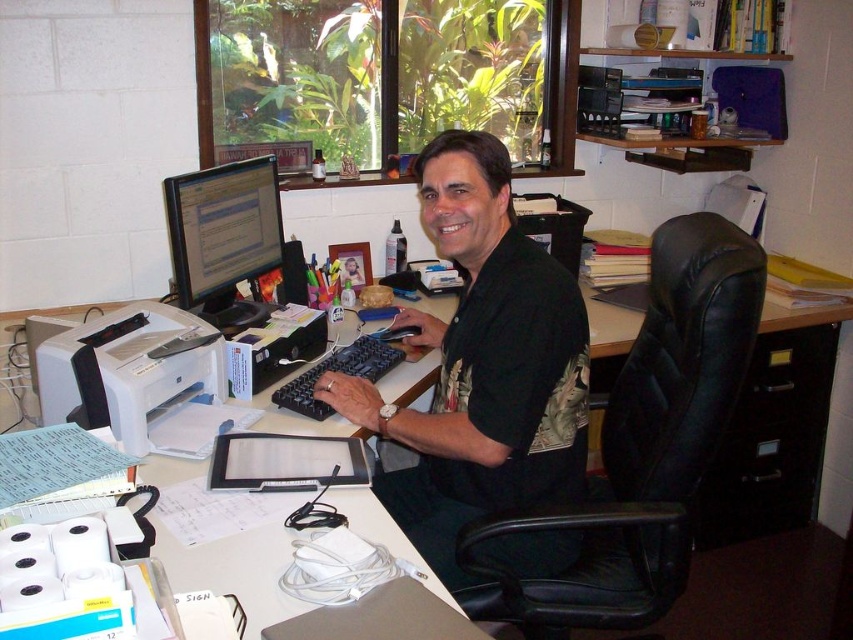
You are organizing the desk and need to place a new item between the white matte printer at left and the matte black monitor at upper left. Based on their current positions, which object should the new item be closer to?

The new item should be closer to the matte black monitor at upper left because the white matte printer at left is positioned on the left side of it, meaning the monitor is to the right of the printer. Therefore, placing the new item closer to the monitor would maintain the existing left to right arrangement.

You are a delivery person who needs to place a package on the desk. The package is as tall as the white matte printer at left. Can you stack it on top of the black matte shirt at center without it falling over?

The black matte shirt at center has a greater height compared to the white matte printer at left, so the package can be safely stacked on top of the black matte shirt at center since it is taller and provides a stable base.

You are an office worker who needs to adjust your seating arrangement for better ergonomics. You have the black leather swivel chair at center and the black plastic monitor at upper center. Which object should you raise to ensure your monitor is at eye level?

The black leather swivel chair at center is taller than the black plastic monitor at upper center. To bring the monitor to eye level, you should lower the black leather swivel chair at center or raise the monitor. However, since monitors are typically adjusted vertically, you might need to use a monitor stand or raise the monitor itself if possible.